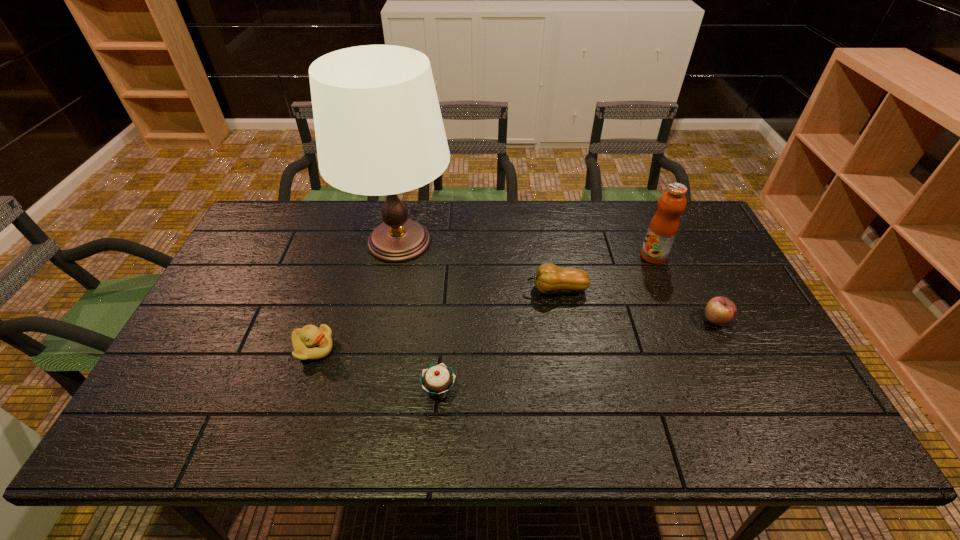
Find the location of a particular element. The image size is (960, 540). vacant space at the far edge of the desktop is located at coordinates (636, 218).

In order to click on free location at the near edge of the desktop in this screenshot , I will do `click(756, 450)`.

Find the location of a particular element. This screenshot has height=540, width=960. free space at the left edge of the desktop is located at coordinates (234, 262).

This screenshot has width=960, height=540. What are the coordinates of `free location at the right edge` in the screenshot? It's located at (721, 269).

In the image, there is a desktop. Where is `vacant space at the far left corner`? vacant space at the far left corner is located at coordinates (278, 205).

This screenshot has width=960, height=540. Find the location of `vacant space at the far right corner`. vacant space at the far right corner is located at coordinates (691, 219).

I want to click on free spot between the lamp and the fruit juice, so click(x=526, y=249).

At what (x,y) coordinates should I click in order to perform the action: click on free spot between the rightmost object and the fourth object from left to right. Please return your answer as a coordinate pair (x, y). This screenshot has width=960, height=540. Looking at the image, I should click on (636, 305).

Identify the location of vacant area that lies between the cupcake and the fourth object from left to right. The width and height of the screenshot is (960, 540). (498, 340).

Where is `free space between the fifth farthest object and the lamp`? This screenshot has height=540, width=960. free space between the fifth farthest object and the lamp is located at coordinates (356, 295).